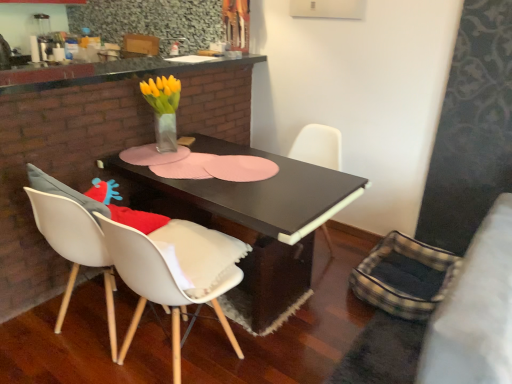
Question: Considering their positions, is granite countertop at upper center located in front of or behind translucent glass vase at center?

Choices:
 (A) behind
 (B) front

Answer: (B)

Question: Based on their positions, is granite countertop at upper center located to the left or right of translucent glass vase at center?

Choices:
 (A) left
 (B) right

Answer: (A)

Question: Considering the real-world distances, which object is farthest from the translucent glass vase at center?

Choices:
 (A) granite countertop at upper center
 (B) white matte chair at lower left, which appears as the second chair when viewed from the right
 (C) black matte chair at center, the first chair when ordered from back to front
 (D) black matte table at center

Answer: (A)

Question: Estimate the real-world distances between objects in this image. Which object is closer to the black matte table at center?

Choices:
 (A) translucent glass vase at center
 (B) white matte chair at lower left, acting as the first chair starting from the front
 (C) granite countertop at upper center
 (D) black matte chair at center, the first chair when ordered from back to front

Answer: (B)